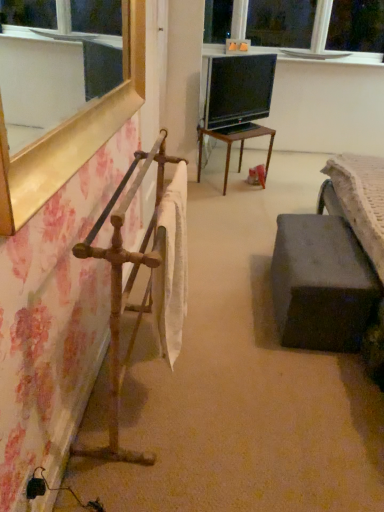
The height and width of the screenshot is (512, 384). In order to click on vacant area that lies between wooden table at center and rusty metal towel rack at left in this screenshot , I will do `click(216, 240)`.